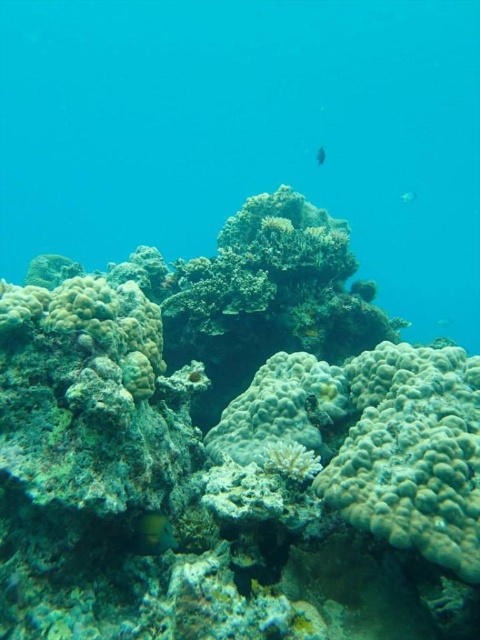
Question: Based on their relative distances, which object is nearer to the translucent blue fish at upper center?

Choices:
 (A) shiny yellow fish at lower left
 (B) shiny blue fish at center

Answer: (B)

Question: Is white coral reef at center positioned at the back of shiny yellow fish at lower left?

Choices:
 (A) no
 (B) yes

Answer: (A)

Question: Does white coral reef at center appear over shiny yellow fish at lower left?

Choices:
 (A) yes
 (B) no

Answer: (A)

Question: Among these points, which one is nearest to the camera?

Choices:
 (A) (149, 550)
 (B) (404, 196)
 (C) (322, 152)

Answer: (A)

Question: Based on their relative distances, which object is nearer to the shiny yellow fish at lower left?

Choices:
 (A) shiny blue fish at center
 (B) white coral reef at center

Answer: (B)

Question: Does shiny yellow fish at lower left have a greater width compared to shiny blue fish at center?

Choices:
 (A) yes
 (B) no

Answer: (B)